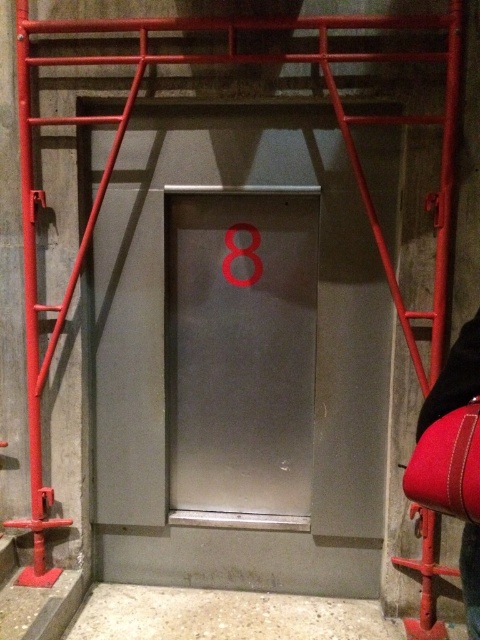
Does satin silver elevator door at center appear under marble floor at lower center?

Incorrect, satin silver elevator door at center is not positioned below marble floor at lower center.

Is satin silver elevator door at center wider than marble floor at lower center?

No.

Find the location of a particular element. The width and height of the screenshot is (480, 640). satin silver elevator door at center is located at coordinates (240, 349).

I want to click on satin silver elevator door at center, so 240,349.

Is red leather pants at lower right bigger than metallic number at center?

Yes.

Measure the distance between point (474,355) and camera.

Point (474,355) is 4.91 feet from camera.

Locate an element on the screen. This screenshot has width=480, height=640. red leather pants at lower right is located at coordinates (455, 378).

Does satin silver elevator door at center have a greater height compared to metallic number at center?

Indeed, satin silver elevator door at center has a greater height compared to metallic number at center.

This screenshot has height=640, width=480. What do you see at coordinates (240, 349) in the screenshot?
I see `satin silver elevator door at center` at bounding box center [240, 349].

Image resolution: width=480 pixels, height=640 pixels. What do you see at coordinates (240, 349) in the screenshot?
I see `satin silver elevator door at center` at bounding box center [240, 349].

I want to click on satin silver elevator door at center, so click(x=240, y=349).